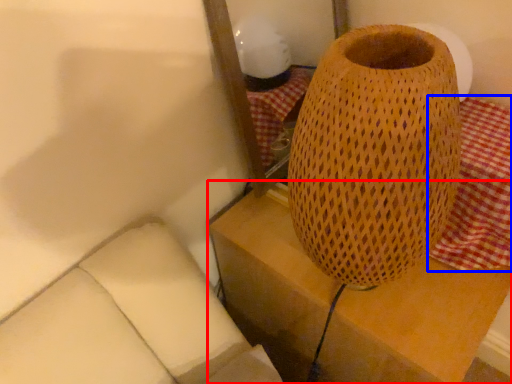
Question: Which point is closer to the camera, furniture (highlighted by a red box) or tablecloth (highlighted by a blue box)?

Choices:
 (A) furniture
 (B) tablecloth

Answer: (B)